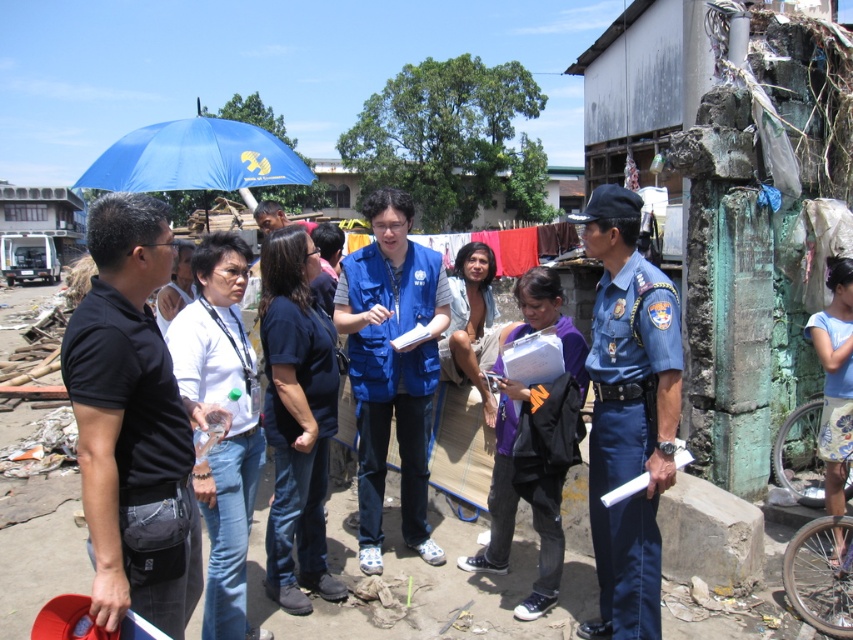
Can you confirm if black matte shirt at left is positioned to the left of blue uniform at center?

Indeed, black matte shirt at left is positioned on the left side of blue uniform at center.

You are a GUI agent. You are given a task and a screenshot of the screen. Output one action in this format:
    pyautogui.click(x=<x>, y=<y>)
    Task: Click on the black matte shirt at left
    This screenshot has height=640, width=853.
    Given the screenshot: What is the action you would take?
    pyautogui.click(x=132, y=422)

Based on the photo, which is more to the left, black matte shirt at left or blue fabric vest at center?

black matte shirt at left

Is black matte shirt at left thinner than blue fabric vest at center?

Yes.

Which is in front, point (144, 429) or point (401, 332)?

Point (144, 429) is in front.

Locate an element on the screen. black matte shirt at left is located at coordinates (132, 422).

Looking at this image, can you confirm if blue fabric vest at center is smaller than blue fabric umbrella at upper left?

Yes, blue fabric vest at center is smaller than blue fabric umbrella at upper left.

Between blue fabric vest at center and blue fabric umbrella at upper left, which one appears on the right side from the viewer's perspective?

From the viewer's perspective, blue fabric vest at center appears more on the right side.

Between point (412, 284) and point (201, 141), which one is positioned in front?

Point (412, 284)

Locate an element on the screen. Image resolution: width=853 pixels, height=640 pixels. blue fabric vest at center is located at coordinates (392, 365).